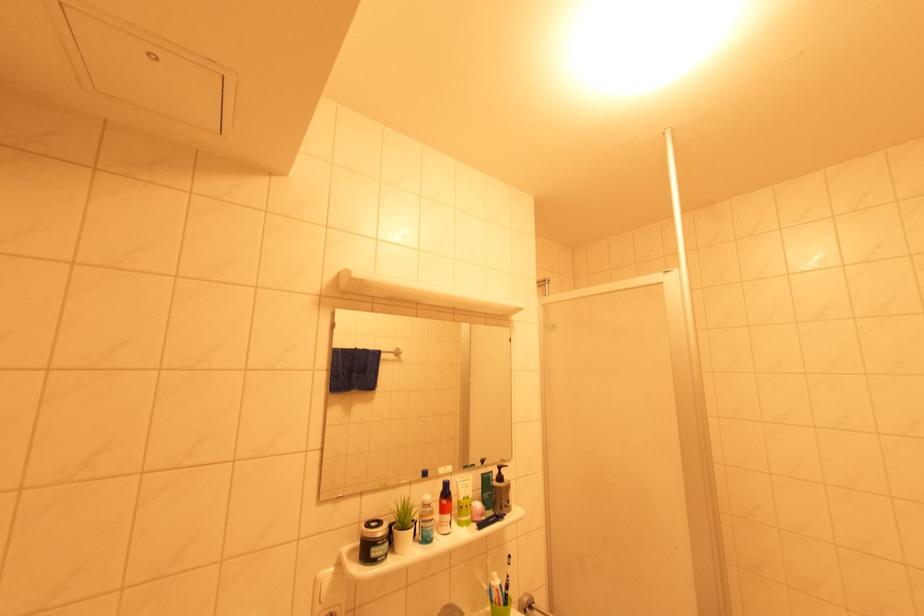
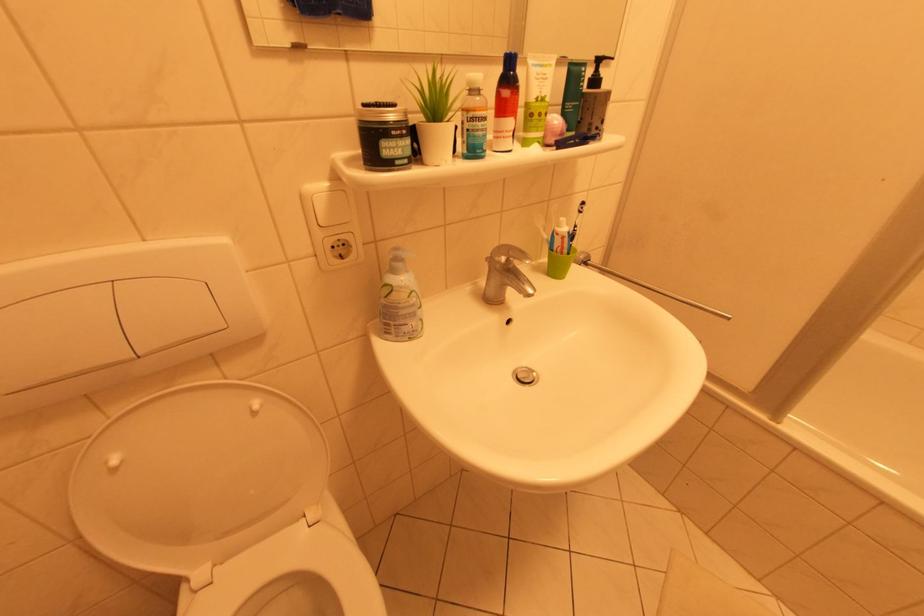
Question: The images are taken continuously from a first-person perspective. In which direction is your viewpoint rotating?

Choices:
 (A) Left
 (B) Right
 (C) Up
 (D) Down

Answer: (D)